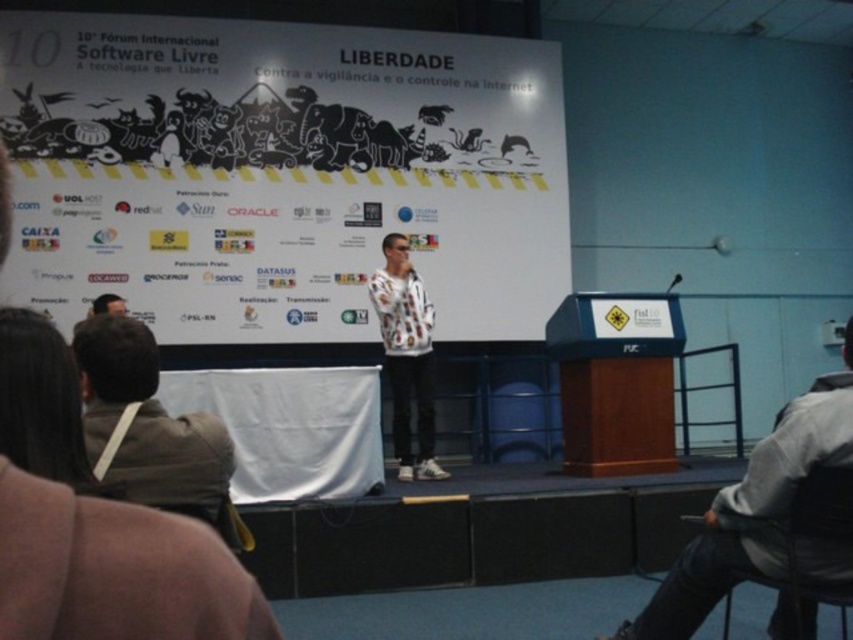
Does point (799, 468) lie behind point (827, 509)?

No, (799, 468) is in front of (827, 509).

Between gray fabric jacket at lower right and black plastic chair at lower right, which one appears on the left side from the viewer's perspective?

gray fabric jacket at lower right is more to the left.

Is point (724, 531) positioned after point (842, 600)?

Yes, it is behind point (842, 600).

Identify the location of gray fabric jacket at lower right. (752, 509).

From the picture: Is gray fabric jacket at lower right wider than brown leather jacket at lower left?

Yes, gray fabric jacket at lower right is wider than brown leather jacket at lower left.

Is gray fabric jacket at lower right smaller than brown leather jacket at lower left?

No, gray fabric jacket at lower right is not smaller than brown leather jacket at lower left.

Image resolution: width=853 pixels, height=640 pixels. Identify the location of gray fabric jacket at lower right. (752, 509).

Is white paper at center further to camera compared to gray fabric jacket at lower right?

Yes.

Is white paper at center in front of gray fabric jacket at lower right?

No, it is behind gray fabric jacket at lower right.

Identify the location of white paper at center. This screenshot has width=853, height=640. (282, 173).